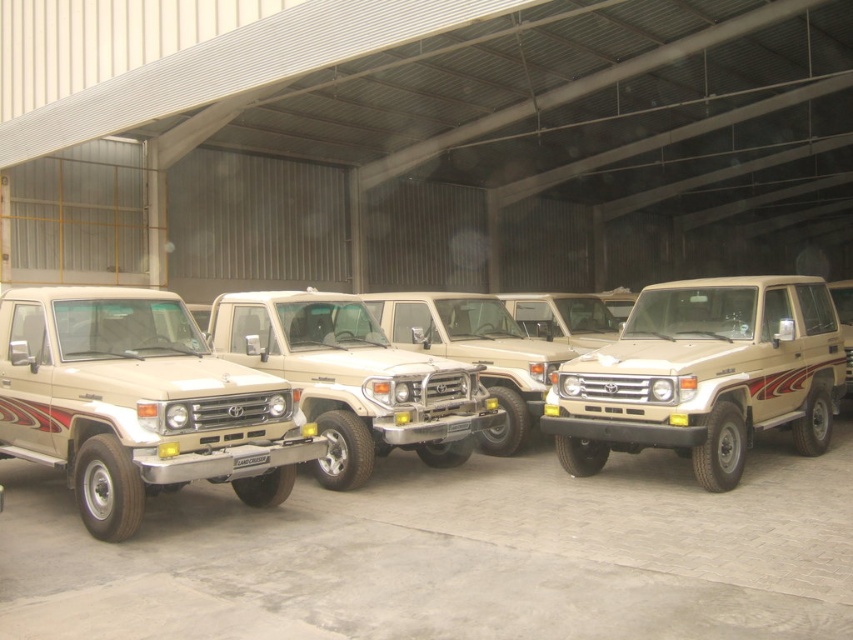
From the picture: Who is shorter, matte beige jeep at center or satin beige jeep at center?

satin beige jeep at center

Can you confirm if matte beige jeep at center is positioned below satin beige jeep at center?

Indeed, matte beige jeep at center is positioned under satin beige jeep at center.

Between point (340, 298) and point (439, 323), which one is positioned behind?

The point (439, 323) is more distant.

Locate an element on the screen. This screenshot has height=640, width=853. matte beige jeep at center is located at coordinates (354, 380).

The height and width of the screenshot is (640, 853). What are the coordinates of `beige matte/soft plastic jeep at left` in the screenshot? It's located at (138, 403).

Which is more to the right, beige matte/soft plastic jeep at left or satin beige jeep at center?

satin beige jeep at center is more to the right.

This screenshot has width=853, height=640. What are the coordinates of `beige matte/soft plastic jeep at left` in the screenshot? It's located at (138, 403).

Identify the location of beige matte/soft plastic jeep at left. [138, 403].

Describe the element at coordinates (138, 403) in the screenshot. I see `beige matte/soft plastic jeep at left` at that location.

Is beige matte/soft plastic jeep at left above matte beige jeep at center?

No.

Is point (268, 376) positioned behind point (262, 323)?

No.

I want to click on beige matte/soft plastic jeep at left, so click(x=138, y=403).